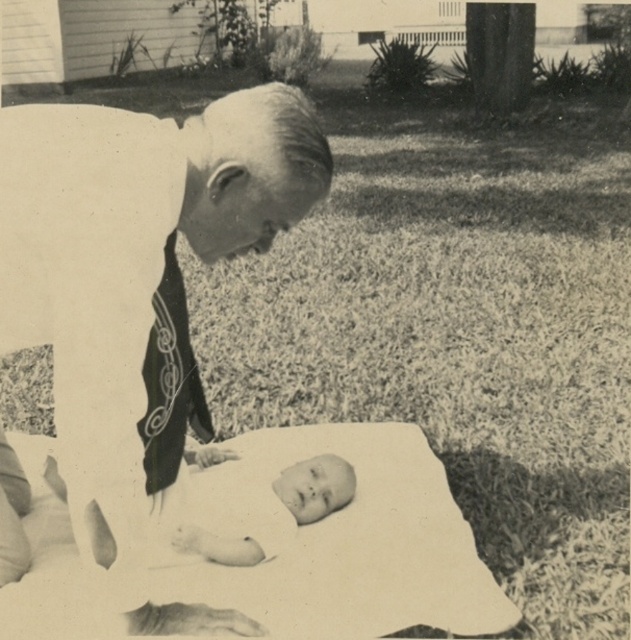
Who is taller, white cloth at upper left or smooth white baby at center?

white cloth at upper left is taller.

In order to click on white cloth at upper left in this screenshot , I will do `click(138, 298)`.